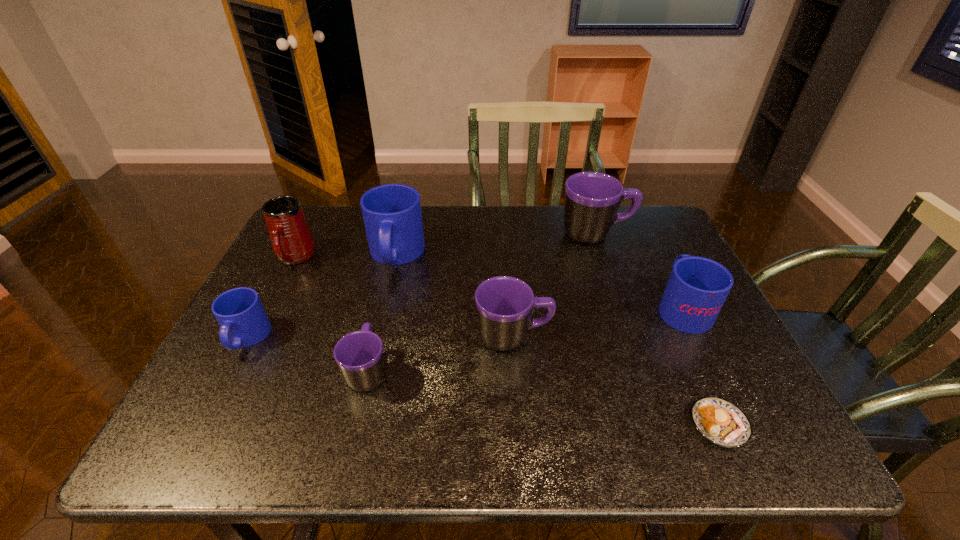
Locate which black mug ranks second in proximity to the shortest object. Please provide its 2D coordinates. Your answer should be formatted as a tuple, i.e. [(x, y)], where the tuple contains the x and y coordinates of a point satisfying the conditions above.

[(592, 199)]

In order to click on vacant position in the image that satisfies the following two spatial constraints: 1. on the side of the pastry with the handle; 2. on the left side of the red mug in this screenshot , I will do `click(210, 424)`.

The width and height of the screenshot is (960, 540). Find the location of `free spot that satisfies the following two spatial constraints: 1. with the handle on the side of the biggest black mug; 2. on the side of the red mug with the handle`. free spot that satisfies the following two spatial constraints: 1. with the handle on the side of the biggest black mug; 2. on the side of the red mug with the handle is located at coordinates (604, 258).

Where is `free space in the image that satisfies the following two spatial constraints: 1. with the handle on the side of the farthest black mug; 2. on the left side of the pastry`? The height and width of the screenshot is (540, 960). free space in the image that satisfies the following two spatial constraints: 1. with the handle on the side of the farthest black mug; 2. on the left side of the pastry is located at coordinates (660, 424).